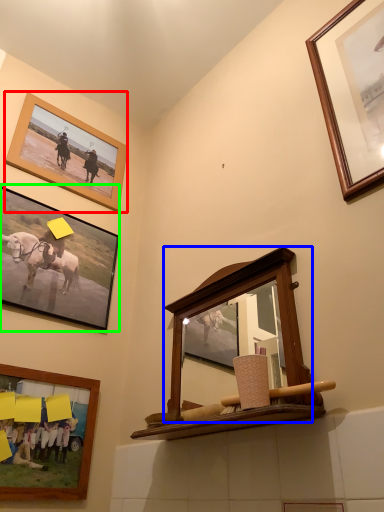
Question: Considering the real-world distances, which object is farthest from picture frame (highlighted by a red box)? mirror (highlighted by a blue box) or picture frame (highlighted by a green box)?

Choices:
 (A) mirror
 (B) picture frame

Answer: (A)